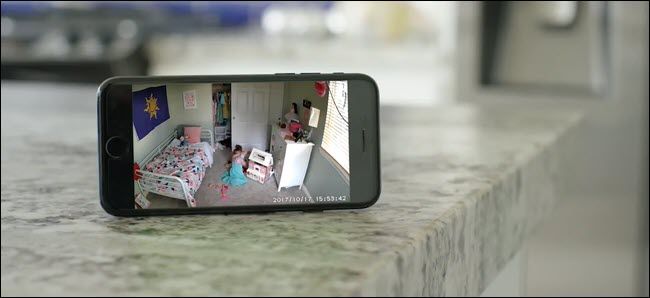
The height and width of the screenshot is (298, 650). I want to click on dollhouse, so click(x=261, y=167).